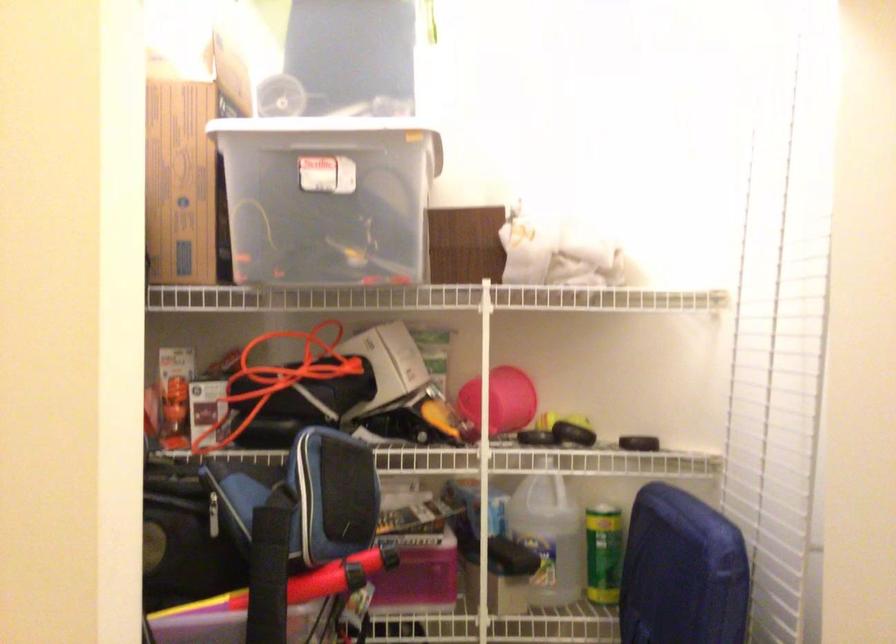
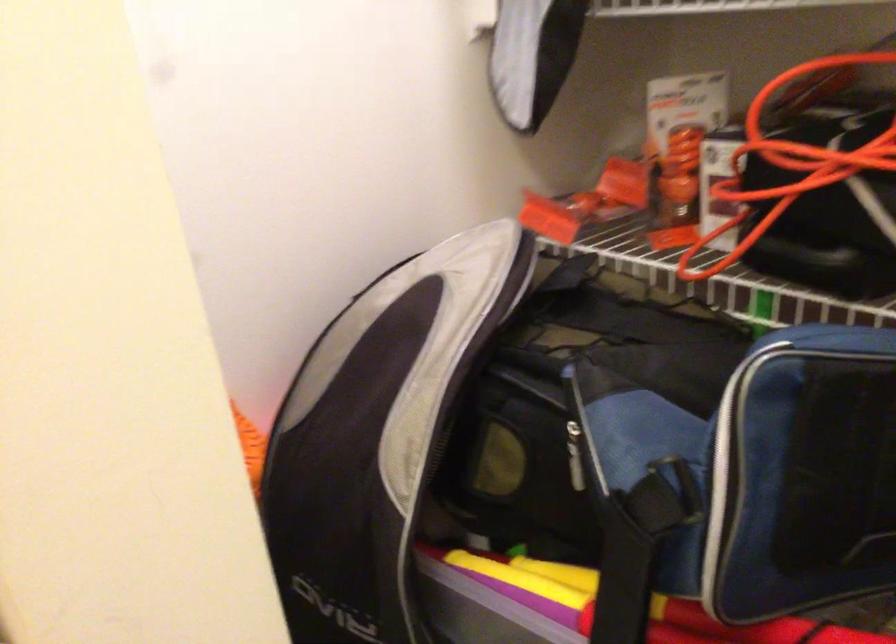
The point at [259,379] is marked in the first image. Where is the corresponding point in the second image?

(791, 163)